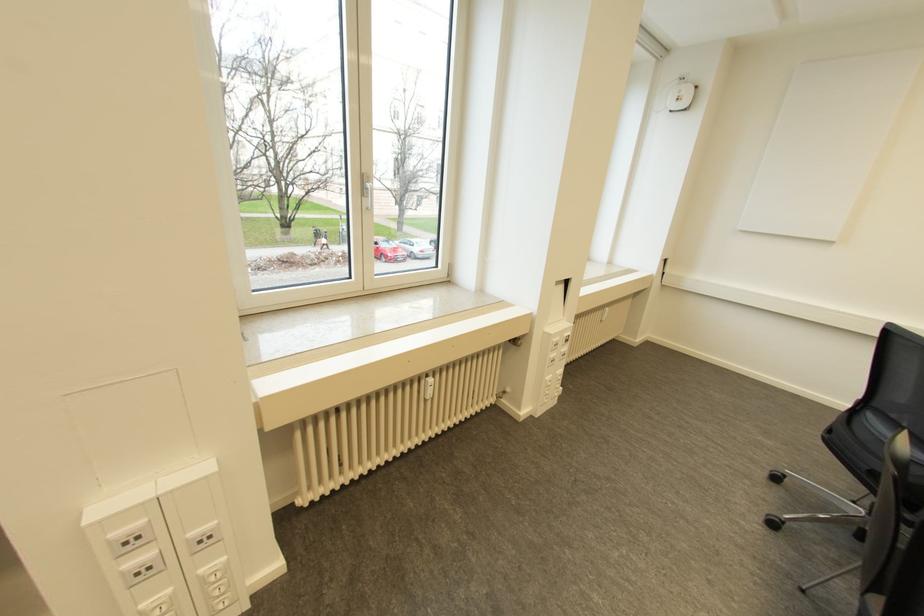
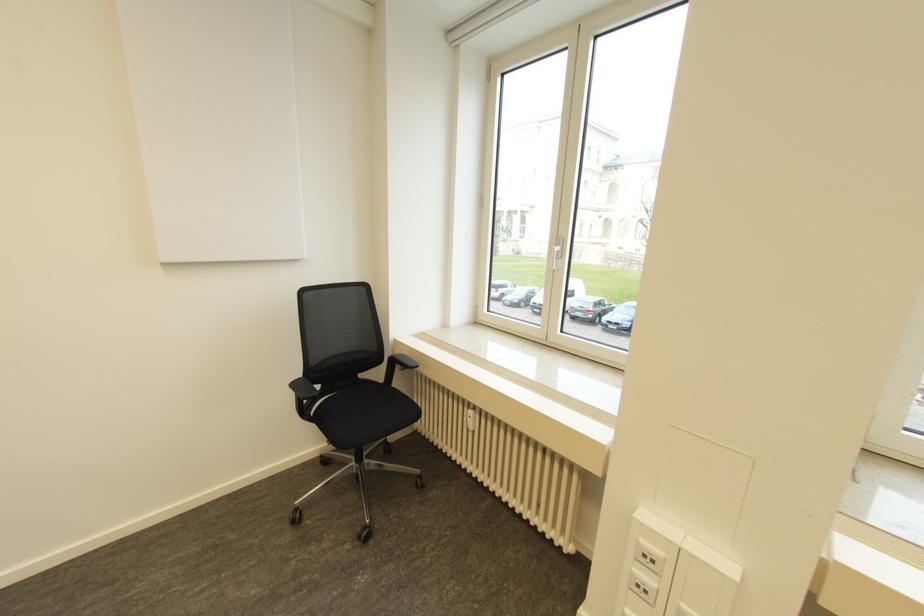
In the second image, find the point that corresponds to (x=137, y=573) in the first image.

(637, 585)